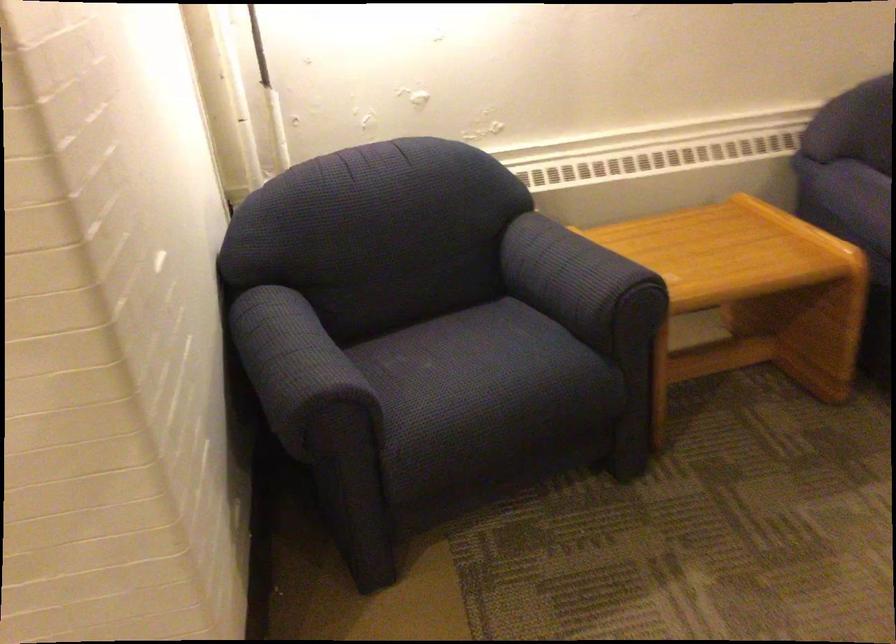
Image resolution: width=896 pixels, height=644 pixels. In order to click on blue chair sitting surface in this screenshot , I will do `click(487, 377)`.